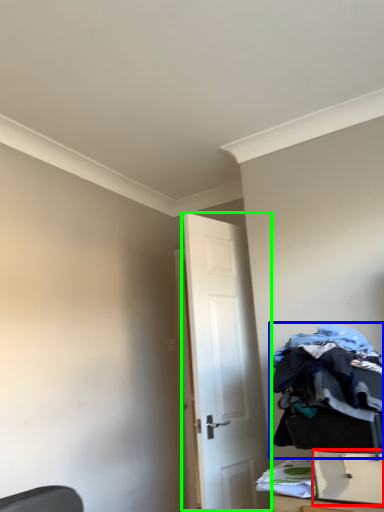
Question: Which is farther away from drawer (highlighted by a red box)? laundry (highlighted by a blue box) or door (highlighted by a green box)?

Choices:
 (A) laundry
 (B) door

Answer: (B)